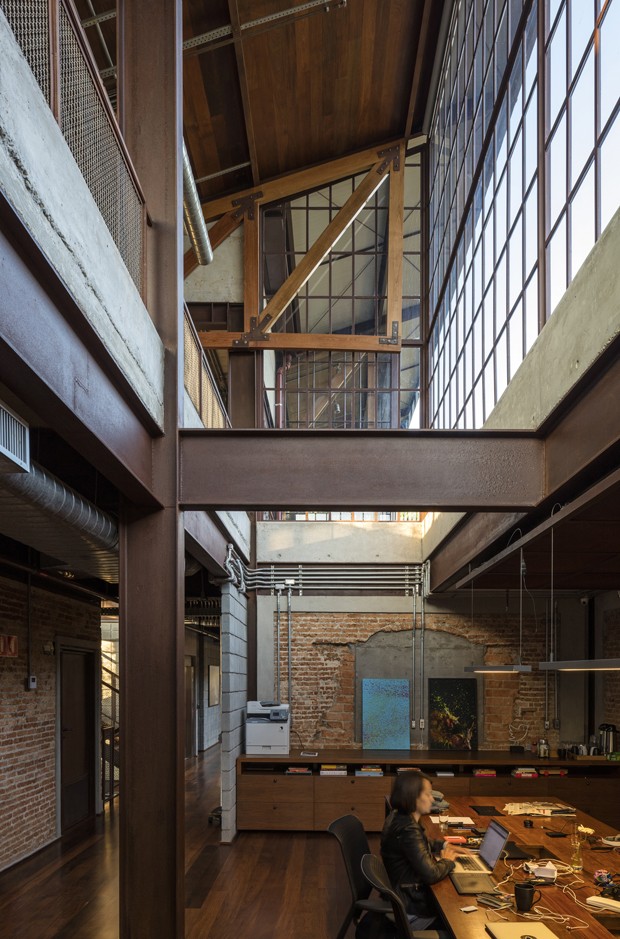
Locate an element on the screen. This screenshot has height=939, width=620. floor is located at coordinates (285, 867).